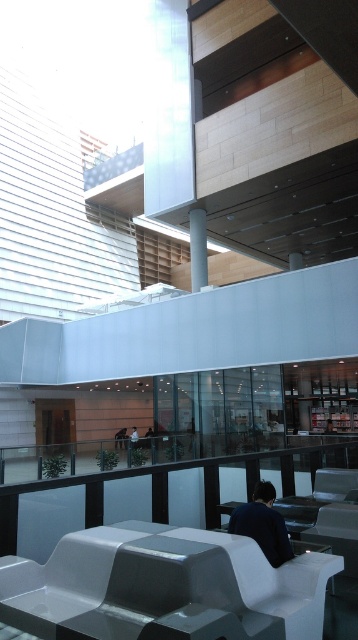
You are standing at the upper part of the image and want to walk down to the lower area. There is a white glossy pillar at upper center and a white fabric person at center in your path. Which object is closer to you?

The white glossy pillar at upper center is closer to you because it is positioned higher up in the image compared to the white fabric person at center, which is located further down towards the center of the scene.

Consider the image. You are standing at the top of the stairs looking down. There is a white glossy bench at lower center and a dark blue shirt at center. Which object is closer to you?

The dark blue shirt at center is closer to you because it is above the white glossy bench at lower center.

You are standing at the entrance of the modern building and want to sit on the white glossy bench at lower center. Based on the coordinates provided, can you estimate how far you need to walk from your current position to reach the bench?

The white glossy bench at lower center is located at coordinates point (162, 582), so you need to walk approximately 0.912 meters from the entrance to reach it.